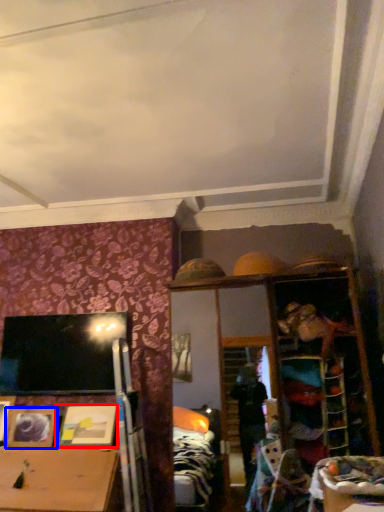
Question: Which object appears farthest to the camera in this image, picture frame (highlighted by a red box) or picture frame (highlighted by a blue box)?

Choices:
 (A) picture frame
 (B) picture frame

Answer: (B)